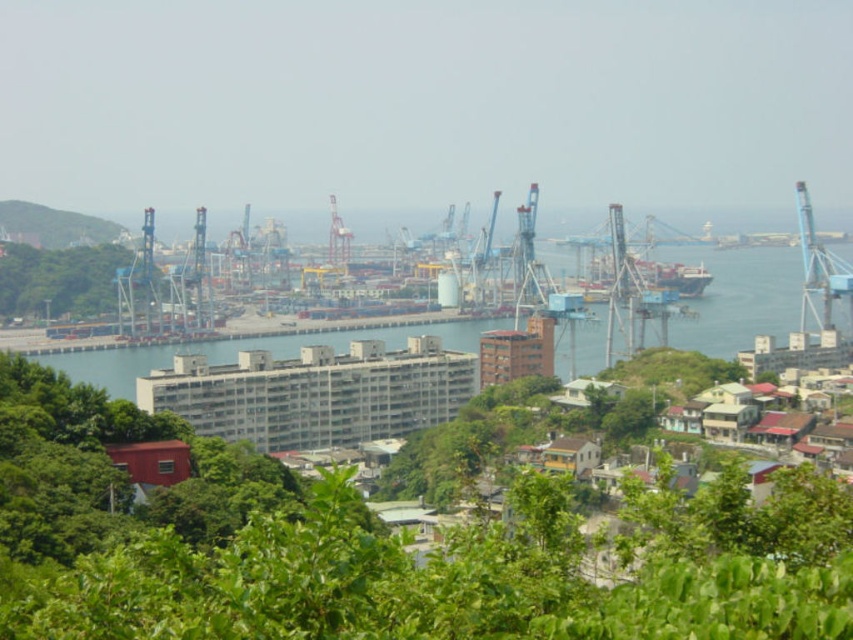
You are a photographer planning to capture the entire port scene in one shot. Given that the green grassy hillside at upper left and the metallic gray container ship at center are both in your frame, which object takes up more area in the photo?

The metallic gray container ship at center occupies more space in the photo than the green grassy hillside at upper left, as it is stated that the hillside occupies less space than the ship.

You are standing at the viewpoint overlooking the port. You notice two points in the scene. The first point is located at coordinates point [107,225] and the second point is at point [679,266]. From your vantage point, which point is closer to you?

Point [679,266] is closer to you because the description states that point [107,225] is behind point [679,266].

You are standing at the viewpoint overlooking the port and want to take a photo that includes both the point at coordinates point [804,243] and point [67,214]. Which point should you position closer to the foreground of your camera frame?

Point [67,214] should be positioned closer to the foreground because it is in front of point [804,243], which is behind it.